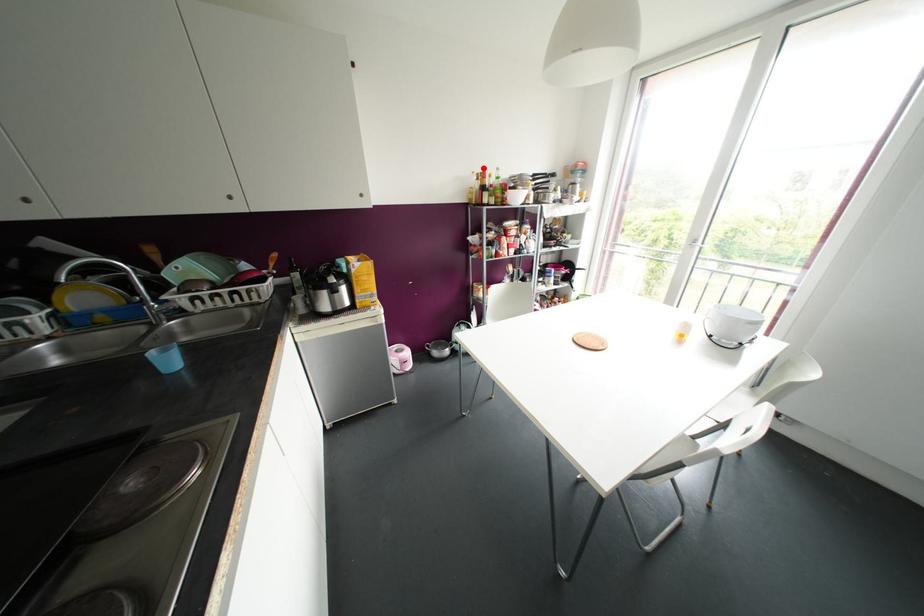
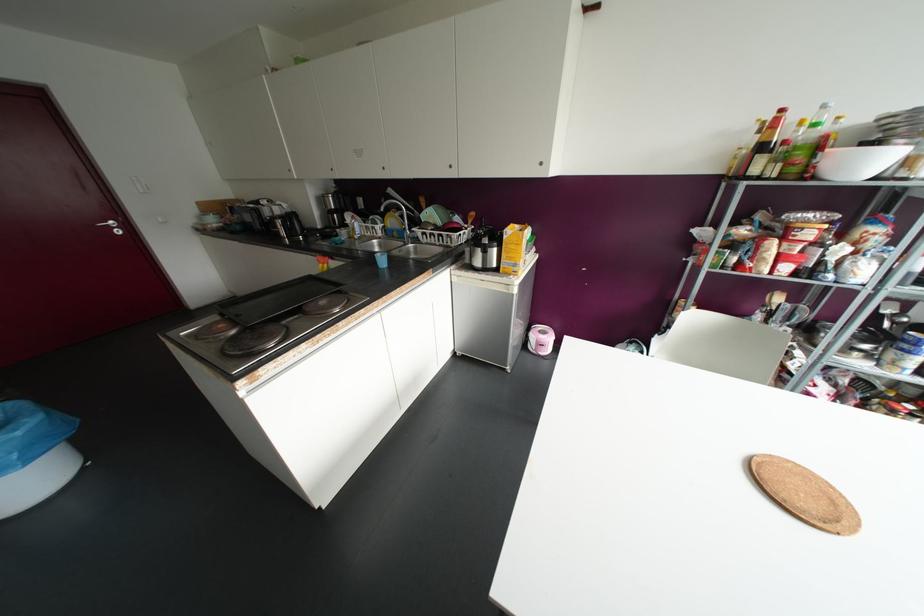
Where in the second image is the point corresponding to the highlighted location from the first image?

(781, 110)